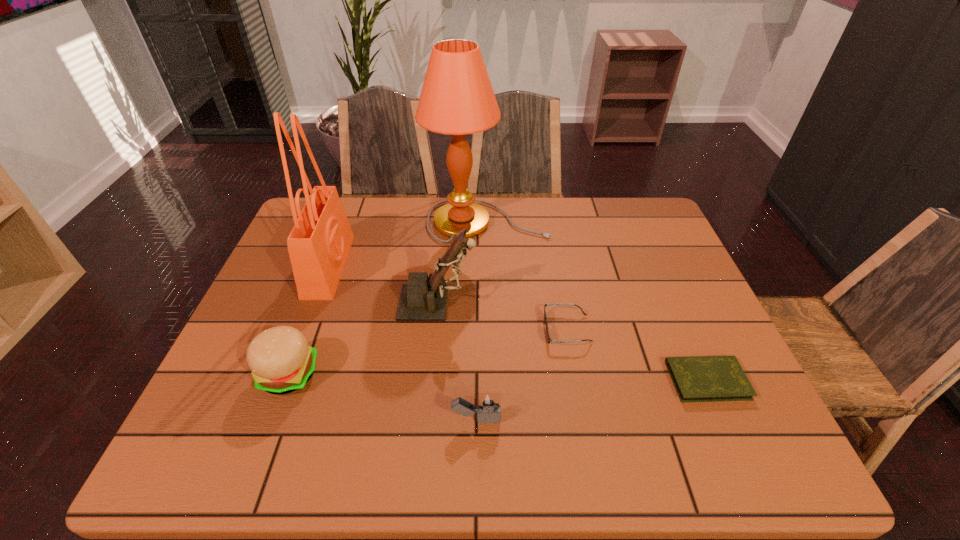
Locate an element on the screen. The image size is (960, 540). free space that is in between the sunglasses and the lamp is located at coordinates (527, 275).

This screenshot has width=960, height=540. Identify the location of free point between the nearest object and the tallest object. (482, 321).

In order to click on free space between the figurine and the igniter in this screenshot , I will do `click(457, 361)`.

Locate an element on the screen. Image resolution: width=960 pixels, height=540 pixels. free spot between the sunglasses and the hamburger is located at coordinates (428, 352).

You are a GUI agent. You are given a task and a screenshot of the screen. Output one action in this format:
    pyautogui.click(x=<x>, y=<y>)
    Task: Click on the free area in between the igniter and the sixth tallest object
    The width and height of the screenshot is (960, 540).
    Given the screenshot: What is the action you would take?
    pyautogui.click(x=521, y=375)

The height and width of the screenshot is (540, 960). Find the location of `empty space that is in between the second tallest object and the fifth shortest object`. empty space that is in between the second tallest object and the fifth shortest object is located at coordinates (383, 285).

Locate an element on the screen. This screenshot has height=540, width=960. free space between the diary and the tallest object is located at coordinates (597, 301).

What are the coordinates of `vacant region between the sixth tallest object and the tote bag` in the screenshot? It's located at (448, 298).

Locate an element on the screen. object that can be found as the fifth closest to the diary is located at coordinates (281, 361).

Locate which object ranks second in proximity to the tote bag. Please provide its 2D coordinates. Your answer should be formatted as a tuple, i.e. [(x, y)], where the tuple contains the x and y coordinates of a point satisfying the conditions above.

[(423, 298)]